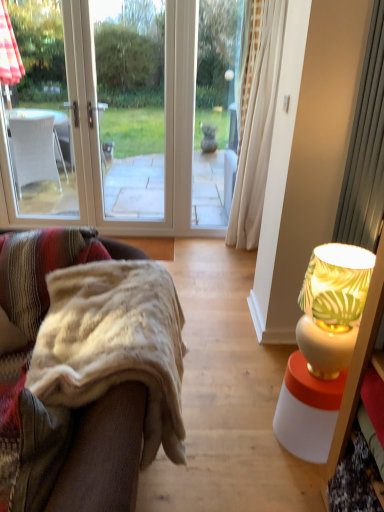
Question: Does white ceramic lamp at right have a greater width compared to fuzzy beige blanket at left?

Choices:
 (A) no
 (B) yes

Answer: (A)

Question: Is fuzzy beige blanket at left inside white ceramic lamp at right?

Choices:
 (A) no
 (B) yes

Answer: (A)

Question: Is white ceramic lamp at right smaller than fuzzy beige blanket at left?

Choices:
 (A) no
 (B) yes

Answer: (B)

Question: Does white ceramic lamp at right have a larger size compared to fuzzy beige blanket at left?

Choices:
 (A) yes
 (B) no

Answer: (B)

Question: Is white ceramic lamp at right far away from fuzzy beige blanket at left?

Choices:
 (A) yes
 (B) no

Answer: (B)

Question: Is fuzzy beige blanket at left at the back of white ceramic lamp at right?

Choices:
 (A) no
 (B) yes

Answer: (A)

Question: Considering the relative positions of fuzzy beige blanket at left and white ceramic lamp at right in the image provided, is fuzzy beige blanket at left to the right of white ceramic lamp at right from the viewer's perspective?

Choices:
 (A) yes
 (B) no

Answer: (B)

Question: Is fuzzy beige blanket at left positioned beyond the bounds of white ceramic lamp at right?

Choices:
 (A) yes
 (B) no

Answer: (A)

Question: Is fuzzy beige blanket at left far away from white ceramic lamp at right?

Choices:
 (A) no
 (B) yes

Answer: (A)

Question: Can you confirm if fuzzy beige blanket at left is smaller than white ceramic lamp at right?

Choices:
 (A) yes
 (B) no

Answer: (B)

Question: Could you tell me if fuzzy beige blanket at left is turned towards white ceramic lamp at right?

Choices:
 (A) yes
 (B) no

Answer: (B)

Question: Can you confirm if fuzzy beige blanket at left is positioned to the left of white ceramic lamp at right?

Choices:
 (A) yes
 (B) no

Answer: (A)

Question: From the image's perspective, relative to fuzzy beige blanket at left, is white ceramic lamp at right above or below?

Choices:
 (A) below
 (B) above

Answer: (B)